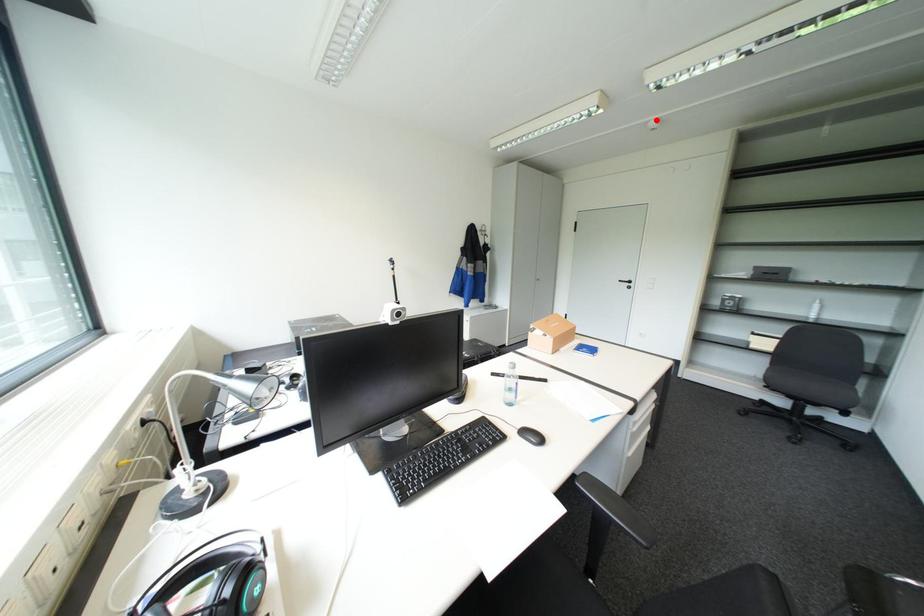
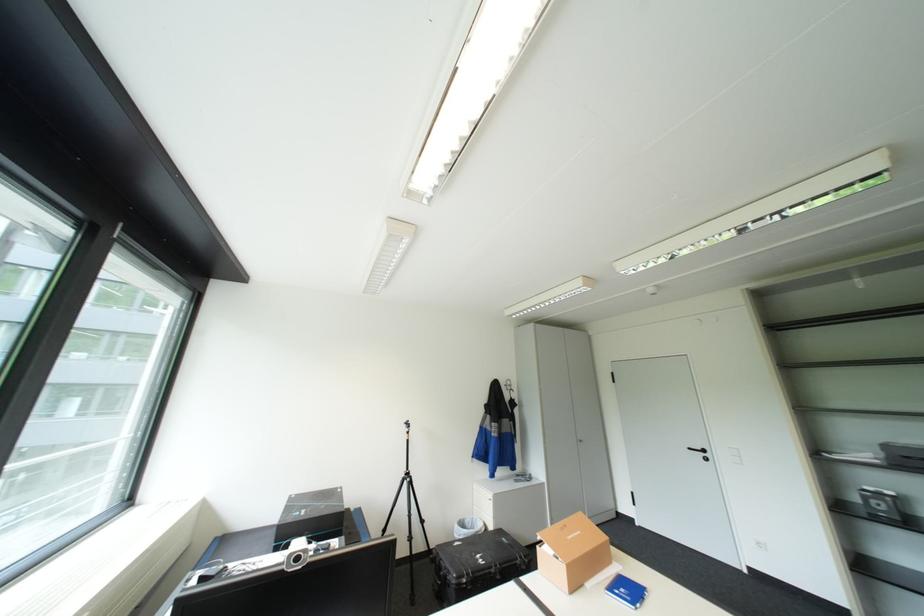
Locate, in the second image, the point that corresponds to the highlighted location in the first image.

(653, 286)